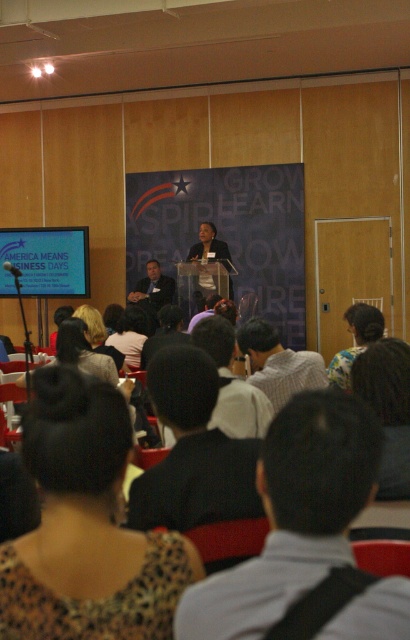
This screenshot has height=640, width=410. Describe the element at coordinates (293, 515) in the screenshot. I see `light gray shirt at center` at that location.

Who is more forward, (302,474) or (122,349)?

Point (302,474) is more forward.

Where is `light gray shirt at center`? The height and width of the screenshot is (640, 410). light gray shirt at center is located at coordinates 293,515.

Does white shirt at center lie behind fluffy white sweater at center?

No.

Does white shirt at center have a lesser height compared to fluffy white sweater at center?

Yes, white shirt at center is shorter than fluffy white sweater at center.

In order to click on white shirt at center in this screenshot , I will do `click(278, 364)`.

Where is `white shirt at center`? The width and height of the screenshot is (410, 640). white shirt at center is located at coordinates (278, 364).

From the picture: Between leopard print blouse at lower left and light gray shirt at center, which one has less height?

light gray shirt at center is shorter.

Based on the photo, is leopard print blouse at lower left above light gray shirt at center?

Actually, leopard print blouse at lower left is below light gray shirt at center.

Is point (109, 525) positioned behind point (245, 609)?

Yes, it is.

Where is `leopard print blouse at lower left`? leopard print blouse at lower left is located at coordinates (86, 525).